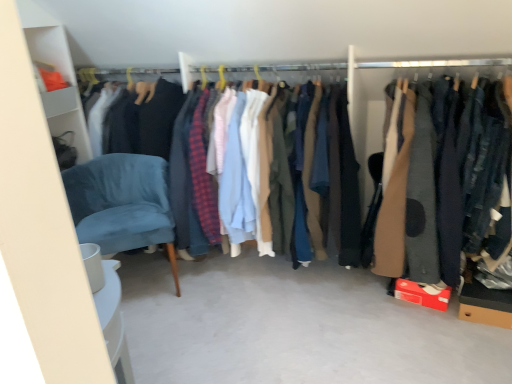
I want to click on free spot in front of matte cotton shirts at center, which appears as the first clothing when viewed from the left, so click(285, 337).